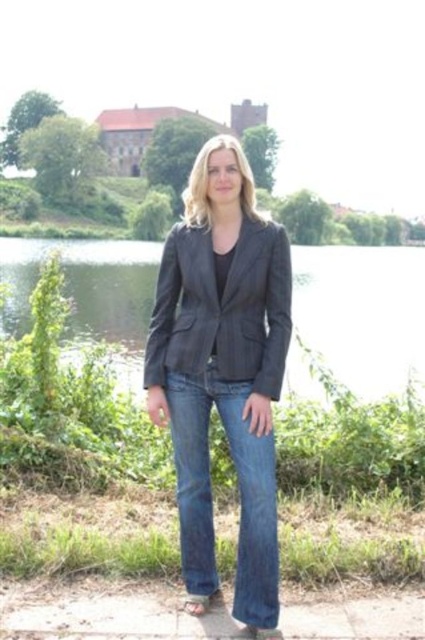
Can you confirm if matte black blazer at center is positioned to the right of dark gray pinstripe blazer at center?

Correct, you'll find matte black blazer at center to the right of dark gray pinstripe blazer at center.

Which of these two, matte black blazer at center or dark gray pinstripe blazer at center, stands taller?

matte black blazer at center is taller.

Who is more forward, (277, 342) or (183, 259)?

Point (277, 342) is in front.

At what (x,y) coordinates should I click in order to perform the action: click on matte black blazer at center. Please return your answer as a coordinate pair (x, y). Looking at the image, I should click on (223, 369).

Does point (195, 276) lie behind point (138, 244)?

No, (195, 276) is closer to viewer.

Can you confirm if matte black blazer at center is positioned below transparent water at center?

Yes.

Identify the location of matte black blazer at center. (223, 369).

Does transparent water at center appear under brown leather sandal at lower center?

No.

Which is below, transparent water at center or brown leather sandal at lower center?

brown leather sandal at lower center

What do you see at coordinates (362, 314) in the screenshot? The image size is (425, 640). I see `transparent water at center` at bounding box center [362, 314].

This screenshot has width=425, height=640. What are the coordinates of `transparent water at center` in the screenshot? It's located at (362, 314).